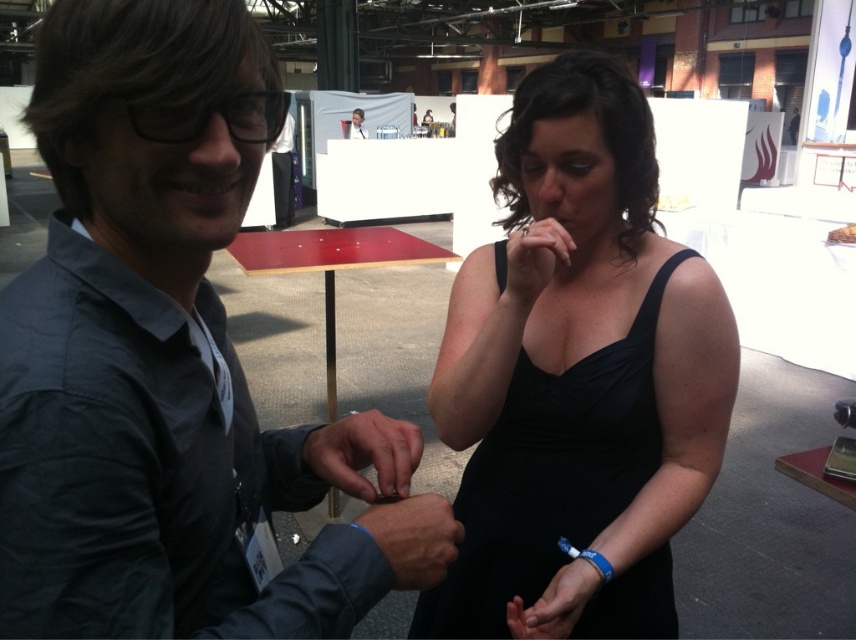
What do you see at coordinates (152, 352) in the screenshot?
I see `matte gray shirt at center` at bounding box center [152, 352].

Measure the distance between matte gray shirt at center and matte black dress at center.

The distance of matte gray shirt at center from matte black dress at center is 18.61 inches.

Is point (147, 113) closer to viewer compared to point (518, 259)?

Yes, it is.

Locate an element on the screen. The height and width of the screenshot is (640, 856). matte gray shirt at center is located at coordinates (152, 352).

Measure the distance between matte black hand at center and matte blue fabric at center.

matte black hand at center is 3.33 inches from matte blue fabric at center.

Is point (351, 426) behind point (409, 522)?

Yes, it is behind point (409, 522).

The height and width of the screenshot is (640, 856). In order to click on matte black hand at center in this screenshot , I will do `click(364, 452)`.

From the picture: Which is more to the left, black satin dress at center or matte black shirt at center?

Positioned to the left is matte black shirt at center.

Is black satin dress at center closer to the viewer compared to matte black shirt at center?

Yes, it is.

Between point (509, 481) and point (352, 109), which one is positioned behind?

Point (352, 109)

Locate an element on the screen. This screenshot has height=640, width=856. black satin dress at center is located at coordinates (550, 476).